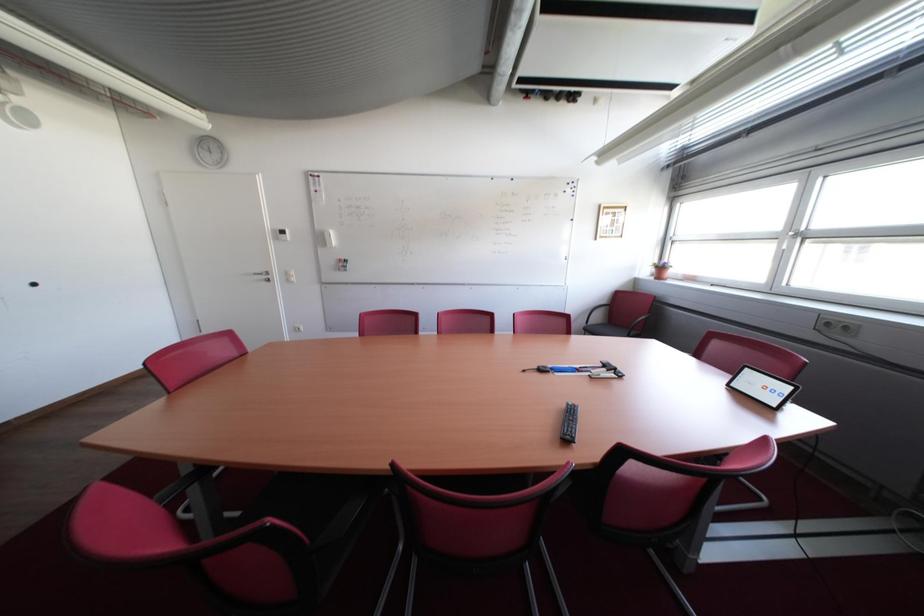
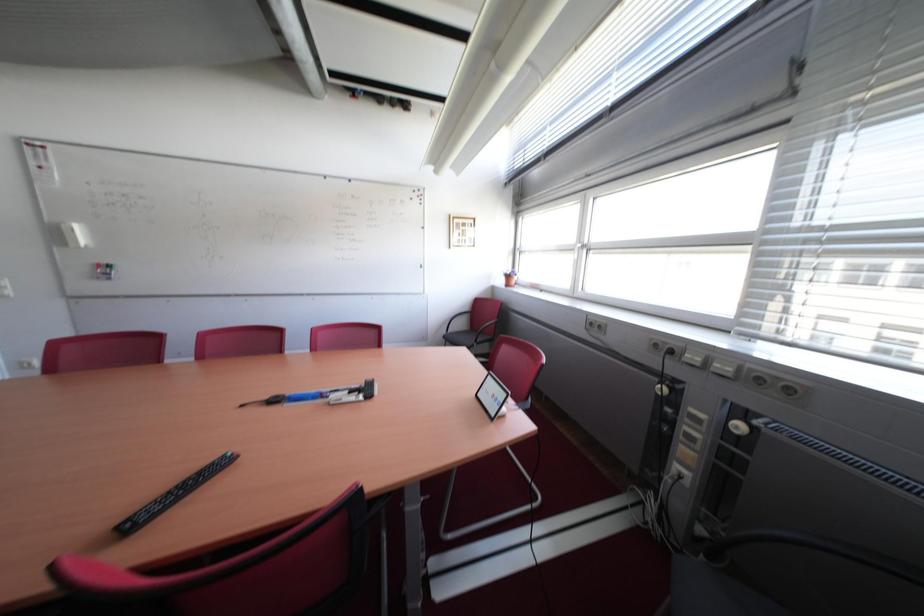
Question: The images are taken continuously from a first-person perspective. In which direction are you moving?

Choices:
 (A) Left
 (B) Right
 (C) Forward
 (D) Backward

Answer: (B)